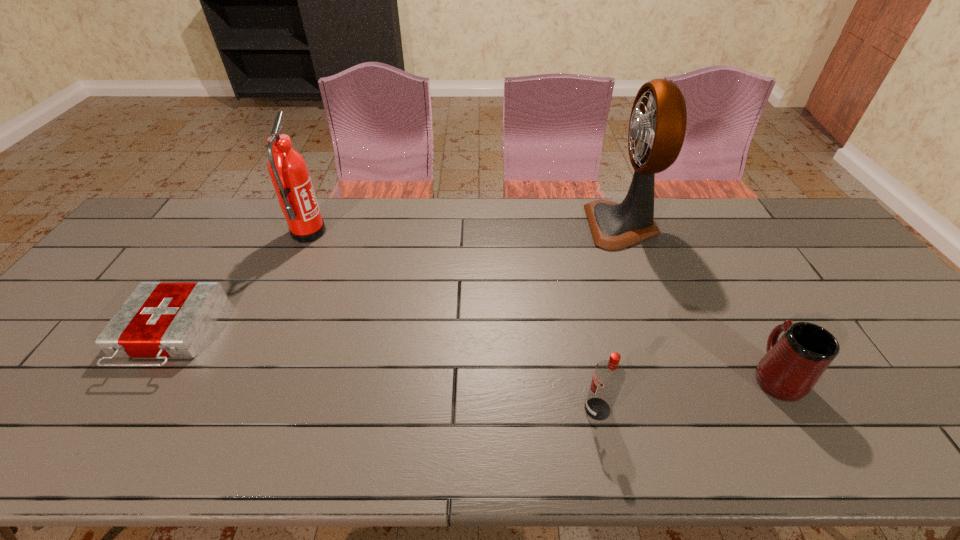
At what (x,y) coordinates should I click in order to perform the action: click on free region that satisfies the following two spatial constraints: 1. on the front-facing side of the fourth object from left to right; 2. on the side of the mug with the handle. Please return your answer as a coordinate pair (x, y). The height and width of the screenshot is (540, 960). Looking at the image, I should click on (679, 375).